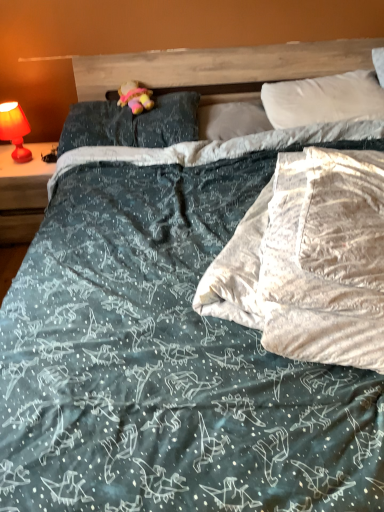
Identify the location of vacant space in front of matte red lamp at left. (18, 174).